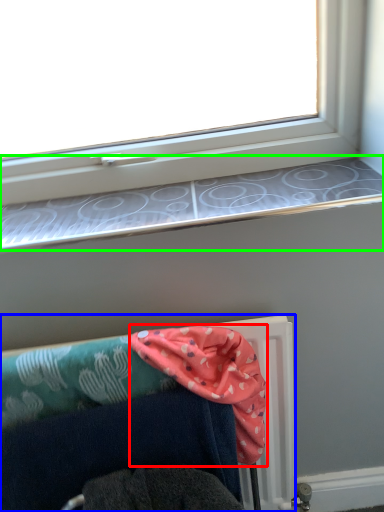
Question: Considering the real-world distances, which object is farthest from scarf (highlighted by a red box)? furniture (highlighted by a blue box) or window sill (highlighted by a green box)?

Choices:
 (A) furniture
 (B) window sill

Answer: (B)